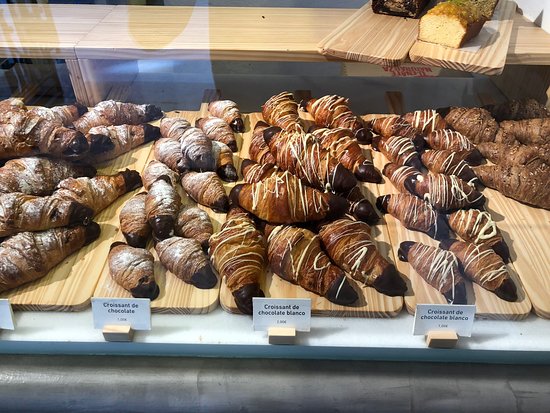
The image size is (550, 413). Identify the location of wooden cutting boards. (65, 281), (185, 297), (274, 292), (492, 313), (522, 230).